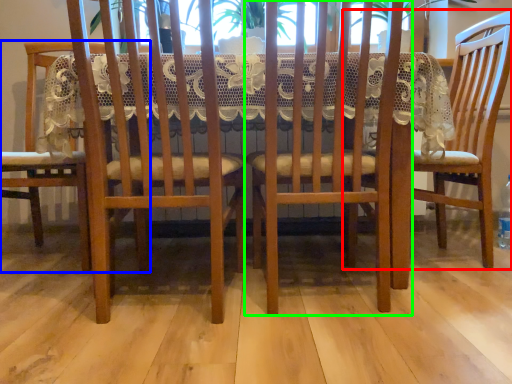
Question: Considering the real-world distances, which object is farthest from chair (highlighted by a red box)? chair (highlighted by a blue box) or chair (highlighted by a green box)?

Choices:
 (A) chair
 (B) chair

Answer: (A)